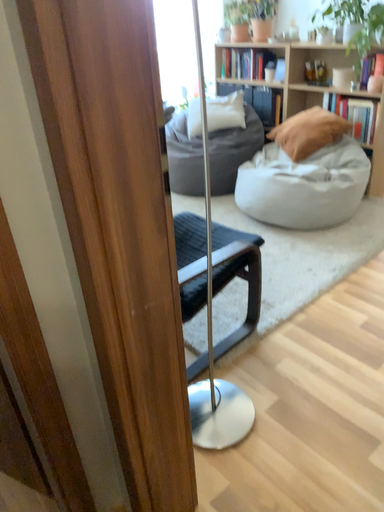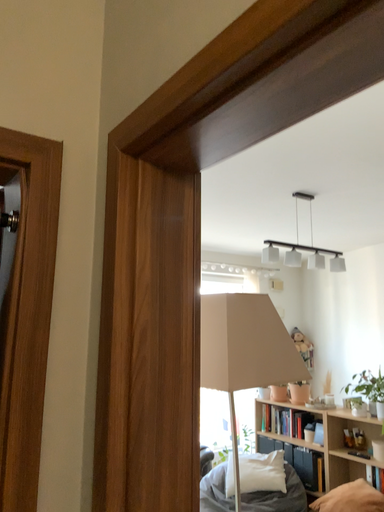
Question: Which way did the camera rotate in the video?

Choices:
 (A) rotated upward
 (B) rotated downward

Answer: (A)